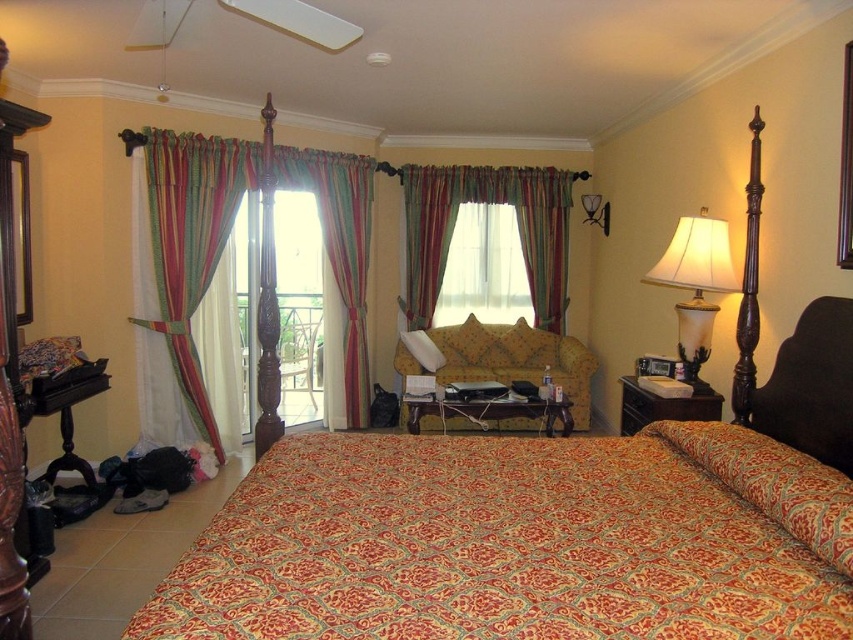
You are a delivery person who needs to place a 1.5 meter long package between the striped fabric curtains at center and the yellow floral fabric sofa at center. Is there enough space to place the package horizontally between them?

The distance between the striped fabric curtains at center and the yellow floral fabric sofa at center is 1.26 meters. Since the package is 1.5 meters long, it is longer than the available space. Therefore, the package cannot be placed horizontally between them.

You are standing at the center of the bedroom and want to place a small plant between the two points, point (357, 392) and point (433, 426). Which point should the plant be closer to so it is in front of the other point?

The plant should be closer to point (433, 426) so it is in front of point (357, 392) because point (357, 392) is behind point (433, 426).